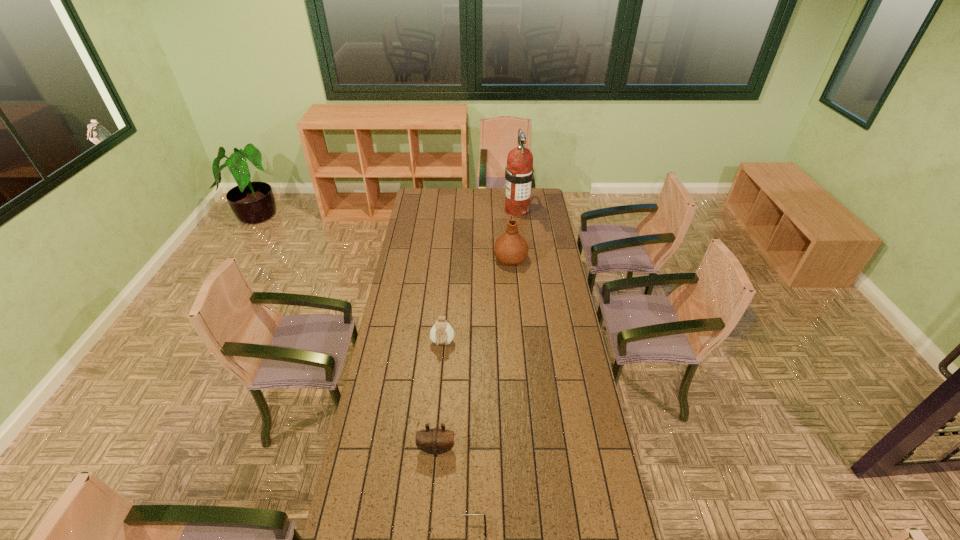
I want to click on vacant space at the far right corner, so (539, 202).

Where is `vacant point located between the pitcher and the shorter pouch`? The width and height of the screenshot is (960, 540). vacant point located between the pitcher and the shorter pouch is located at coordinates (473, 354).

I want to click on free spot between the shorter pouch and the fire extinguisher, so click(477, 329).

At what (x,y) coordinates should I click in order to perform the action: click on free space between the fourth farthest object and the third tallest object. Please return your answer as a coordinate pair (x, y). Looking at the image, I should click on (440, 396).

This screenshot has width=960, height=540. I want to click on unoccupied position between the tallest object and the second shortest object, so click(x=477, y=329).

The width and height of the screenshot is (960, 540). What are the coordinates of `vacant region between the farthest object and the fourth tallest object` in the screenshot? It's located at (477, 329).

You are a GUI agent. You are given a task and a screenshot of the screen. Output one action in this format:
    pyautogui.click(x=<x>, y=<y>)
    Task: Click on the vacant space that is in between the farthest object and the taller pouch
    Image resolution: width=960 pixels, height=540 pixels.
    Given the screenshot: What is the action you would take?
    pyautogui.click(x=480, y=277)

Identify which object is located as the second nearest to the farther pouch. Please provide its 2D coordinates. Your answer should be formatted as a tuple, i.e. [(x, y)], where the tuple contains the x and y coordinates of a point satisfying the conditions above.

[(511, 248)]

At what (x,y) coordinates should I click in order to perform the action: click on object that is the closest to the second shortest object. Please return your answer as a coordinate pair (x, y). The height and width of the screenshot is (540, 960). Looking at the image, I should click on (461, 514).